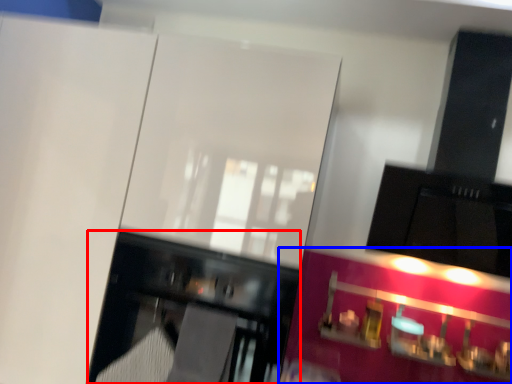
Question: Which object is further to the camera taking this photo, furniture (highlighted by a red box) or cabinetry (highlighted by a blue box)?

Choices:
 (A) furniture
 (B) cabinetry

Answer: (B)